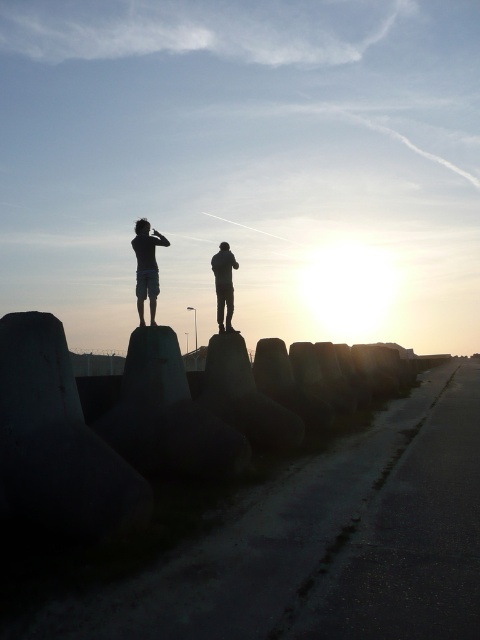
You are a photographer standing on the pathway at the coastal area. You want to take a photo of the two silhouette figures at center and the silhouette figure at center. How far apart are they from each other?

The silhouette figures at center and the silhouette figure at center are 2.35 meters apart from each other.

You are a photographer planning to capture the sunset scene with both the silhouette figures at center and the silhouette human at center in the frame. Which of the two objects should you focus on if you want to emphasize the larger subject in your composition?

You should focus on the silhouette figures at center because it has a larger size compared to the silhouette human at center, making it the more prominent subject for emphasizing size in the composition.

You are a photographer trying to capture the sunset at the coastal pathway. You notice two people, the silhouette human at center and the silhouette figure at center. Which one is closer to the camera based on their position?

The silhouette human at center is closer to the camera because it is in front of the silhouette figure at center.